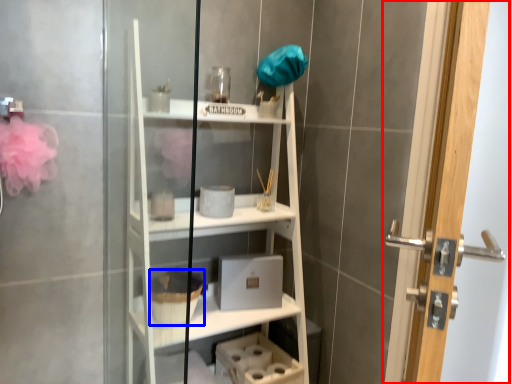
Question: Which object is closer to the camera taking this photo, door (highlighted by a red box) or basket (highlighted by a blue box)?

Choices:
 (A) door
 (B) basket

Answer: (A)